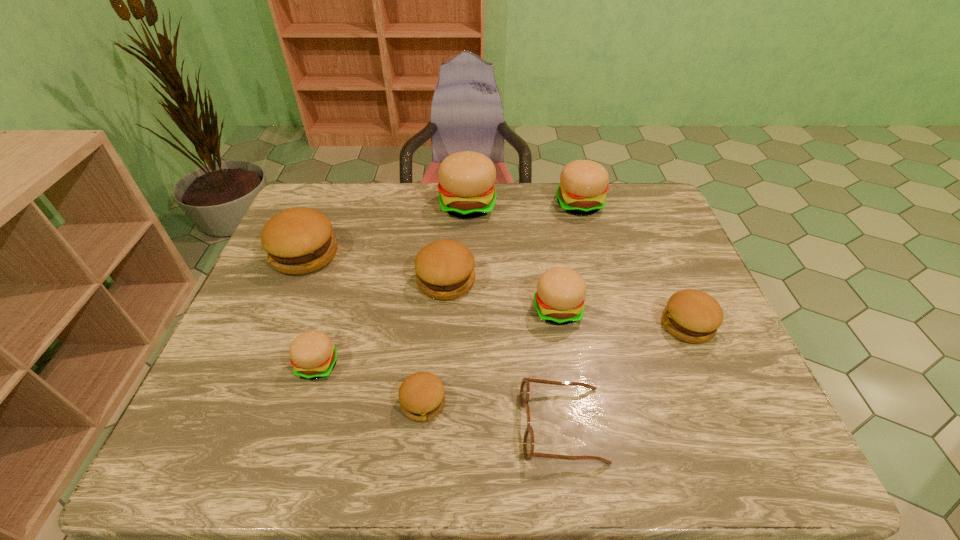
Identify the location of free space between the third smallest brown hamburger and the nearest beige hamburger. The height and width of the screenshot is (540, 960). (382, 322).

You are a GUI agent. You are given a task and a screenshot of the screen. Output one action in this format:
    pyautogui.click(x=<x>, y=<y>)
    Task: Click on the fifth closest object to the second biggest beige hamburger
    The height and width of the screenshot is (540, 960).
    Given the screenshot: What is the action you would take?
    pyautogui.click(x=528, y=441)

Locate which object ranks fourth in proximity to the second smallest brown hamburger. Please provide its 2D coordinates. Your answer should be formatted as a tuple, i.e. [(x, y)], where the tuple contains the x and y coordinates of a point satisfying the conditions above.

[(444, 269)]

The width and height of the screenshot is (960, 540). Identify the location of the fourth closest hamburger to the biggest beige hamburger. (x=560, y=296).

Locate which hamburger is the seventh closest to the tallest object. Please provide its 2D coordinates. Your answer should be formatted as a tuple, i.e. [(x, y)], where the tuple contains the x and y coordinates of a point satisfying the conditions above.

[(421, 395)]

Choose which beige hamburger is the third nearest neighbor to the tallest hamburger. Please provide its 2D coordinates. Your answer should be formatted as a tuple, i.e. [(x, y)], where the tuple contains the x and y coordinates of a point satisfying the conditions above.

[(312, 354)]

Locate which beige hamburger ranks in proximity to the third beige hamburger from right to left. Please provide its 2D coordinates. Your answer should be formatted as a tuple, i.e. [(x, y)], where the tuple contains the x and y coordinates of a point satisfying the conditions above.

[(583, 185)]

Select which brown hamburger appears as the second closest to the nearest brown hamburger. Please provide its 2D coordinates. Your answer should be formatted as a tuple, i.e. [(x, y)], where the tuple contains the x and y coordinates of a point satisfying the conditions above.

[(298, 241)]

Find the location of a particular element. The height and width of the screenshot is (540, 960). brown hamburger that is the second nearest to the third farthest beige hamburger is located at coordinates tap(693, 316).

This screenshot has width=960, height=540. Identify the location of vacant region that satisfies the following two spatial constraints: 1. on the back side of the third smallest beige hamburger; 2. on the right side of the smallest beige hamburger. (367, 204).